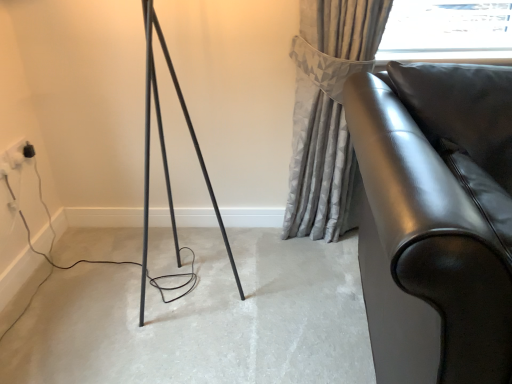
Question: From a real-world perspective, is glossy leather sofa at right on black plastic outlet at lower left?

Choices:
 (A) no
 (B) yes

Answer: (A)

Question: Does glossy leather sofa at right have a greater width compared to black plastic outlet at lower left?

Choices:
 (A) yes
 (B) no

Answer: (A)

Question: Is the depth of glossy leather sofa at right less than that of black plastic outlet at lower left?

Choices:
 (A) yes
 (B) no

Answer: (A)

Question: Can you confirm if glossy leather sofa at right is shorter than black plastic outlet at lower left?

Choices:
 (A) no
 (B) yes

Answer: (A)

Question: Considering the relative sizes of glossy leather sofa at right and black plastic outlet at lower left in the image provided, is glossy leather sofa at right taller than black plastic outlet at lower left?

Choices:
 (A) yes
 (B) no

Answer: (A)

Question: Is glossy leather sofa at right to the right of black plastic outlet at lower left from the viewer's perspective?

Choices:
 (A) no
 (B) yes

Answer: (B)

Question: Is gray textured curtain at upper right located within black plastic outlet at lower left?

Choices:
 (A) no
 (B) yes

Answer: (A)

Question: Is black plastic outlet at lower left completely or partially outside of gray textured curtain at upper right?

Choices:
 (A) no
 (B) yes

Answer: (B)

Question: Is black plastic outlet at lower left smaller than gray textured curtain at upper right?

Choices:
 (A) no
 (B) yes

Answer: (B)

Question: Does black plastic outlet at lower left appear on the left side of gray textured curtain at upper right?

Choices:
 (A) no
 (B) yes

Answer: (B)

Question: Considering the relative sizes of black plastic outlet at lower left and gray textured curtain at upper right in the image provided, is black plastic outlet at lower left wider than gray textured curtain at upper right?

Choices:
 (A) yes
 (B) no

Answer: (B)

Question: Does black plastic outlet at lower left turn towards gray textured curtain at upper right?

Choices:
 (A) yes
 (B) no

Answer: (A)

Question: Is glossy leather sofa at right wider than matte black floor at center?

Choices:
 (A) yes
 (B) no

Answer: (A)